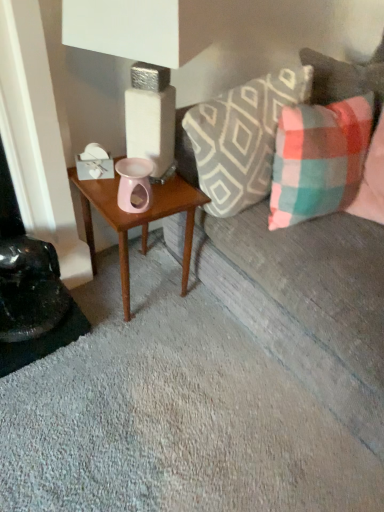
The height and width of the screenshot is (512, 384). Describe the element at coordinates (242, 138) in the screenshot. I see `plaid fabric pillow at upper right, which is the 1th pillow in left-to-right order` at that location.

At what (x,y) coordinates should I click in order to perform the action: click on plaid fabric pillow at upper right, arranged as the 2th pillow when viewed from the right. Please return your answer as a coordinate pair (x, y). This screenshot has height=512, width=384. Looking at the image, I should click on (242, 138).

Identify the location of plaid fabric couch at upper right. (308, 302).

The height and width of the screenshot is (512, 384). What are the coordinates of `plaid fabric pillow at right, which is the second pillow from left to right` in the screenshot? It's located at (319, 159).

Measure the distance between plaid fabric couch at upper right and plaid fabric pillow at right, the 1th pillow viewed from the right.

They are 24.21 centimeters apart.

From a real-world perspective, who is located higher, plaid fabric couch at upper right or plaid fabric pillow at right, which is the second pillow from left to right?

In real-world perspective, plaid fabric pillow at right, which is the second pillow from left to right, is above.

Can you confirm if plaid fabric couch at upper right is taller than plaid fabric pillow at right, which is the second pillow from left to right?

Indeed, plaid fabric couch at upper right has a greater height compared to plaid fabric pillow at right, which is the second pillow from left to right.

Which of these two, plaid fabric couch at upper right or plaid fabric pillow at right, which is the second pillow from left to right, is smaller?

plaid fabric pillow at right, which is the second pillow from left to right.

Consider the image. From the image's perspective, is plaid fabric pillow at right, the 1th pillow viewed from the right, above or below wooden table at center?

Clearly, from the image's perspective, plaid fabric pillow at right, the 1th pillow viewed from the right, is above wooden table at center.

From the picture: Considering the relative positions of plaid fabric pillow at right, the 1th pillow viewed from the right, and wooden table at center in the image provided, is plaid fabric pillow at right, the 1th pillow viewed from the right, behind wooden table at center?

No, plaid fabric pillow at right, the 1th pillow viewed from the right, is in front of wooden table at center.

Could you measure the distance between plaid fabric pillow at right, which is the second pillow from left to right, and wooden table at center?

plaid fabric pillow at right, which is the second pillow from left to right, and wooden table at center are 15.92 inches apart from each other.

Where is `table located on the left of plaid fabric pillow at right, the 1th pillow viewed from the right`? Image resolution: width=384 pixels, height=512 pixels. table located on the left of plaid fabric pillow at right, the 1th pillow viewed from the right is located at coordinates (138, 220).

Looking at this image, is wooden table at center to the left or to the right of plaid fabric couch at upper right in the image?

From the image, it's evident that wooden table at center is to the left of plaid fabric couch at upper right.

From a real-world perspective, which object stands above the other?

plaid fabric couch at upper right.

Is there a large distance between wooden table at center and plaid fabric couch at upper right?

They are positioned close to each other.

From the picture: Which is in front, wooden table at center or plaid fabric couch at upper right?

Positioned in front is plaid fabric couch at upper right.

Considering the positions of objects plaid fabric couch at upper right and plaid fabric pillow at upper right, which is the 1th pillow in left-to-right order, in the image provided, who is more to the right, plaid fabric couch at upper right or plaid fabric pillow at upper right, which is the 1th pillow in left-to-right order,?

Result: Positioned to the right is plaid fabric couch at upper right.

Where is `studio couch in front of the plaid fabric pillow at upper right, arranged as the 2th pillow when viewed from the right`? This screenshot has width=384, height=512. studio couch in front of the plaid fabric pillow at upper right, arranged as the 2th pillow when viewed from the right is located at coordinates (308, 302).

Considering the sizes of objects plaid fabric couch at upper right and plaid fabric pillow at upper right, arranged as the 2th pillow when viewed from the right, in the image provided, who is wider, plaid fabric couch at upper right or plaid fabric pillow at upper right, arranged as the 2th pillow when viewed from the right,?

plaid fabric couch at upper right.

Choose the correct answer: Is plaid fabric couch at upper right inside plaid fabric pillow at upper right, which is the 1th pillow in left-to-right order, or outside it?

The correct answer is: outside.

Considering the relative positions of plaid fabric pillow at right, the 1th pillow viewed from the right, and plaid fabric couch at upper right in the image provided, is plaid fabric pillow at right, the 1th pillow viewed from the right, to the right of plaid fabric couch at upper right from the viewer's perspective?

No.

Which point is more forward, (317, 106) or (245, 319)?

Positioned in front is point (317, 106).

Is plaid fabric pillow at right, the 1th pillow viewed from the right, with plaid fabric couch at upper right?

No, plaid fabric pillow at right, the 1th pillow viewed from the right, is not touching plaid fabric couch at upper right.

Is the depth of plaid fabric pillow at right, which is the second pillow from left to right, greater than that of plaid fabric couch at upper right?

Yes, it is behind plaid fabric couch at upper right.

From a real-world perspective, is wooden table at center physically located above or below plaid fabric pillow at right, the 1th pillow viewed from the right?

Clearly, from a real-world perspective, wooden table at center is below plaid fabric pillow at right, the 1th pillow viewed from the right.

Which object is wider, wooden table at center or plaid fabric pillow at right, which is the second pillow from left to right?

With larger width is plaid fabric pillow at right, which is the second pillow from left to right.

Is plaid fabric pillow at right, which is the second pillow from left to right, at the back of wooden table at center?

That's not correct — wooden table at center is not looking away from plaid fabric pillow at right, which is the second pillow from left to right.

Based on the photo, from the image's perspective, which object appears higher, wooden table at center or plaid fabric pillow at right, the 1th pillow viewed from the right?

plaid fabric pillow at right, the 1th pillow viewed from the right, appears higher in the image.

Is plaid fabric couch at upper right bigger or smaller than wooden table at center?

In the image, plaid fabric couch at upper right appears to be larger than wooden table at center.

Is plaid fabric couch at upper right shorter than wooden table at center?

Incorrect, the height of plaid fabric couch at upper right does not fall short of that of wooden table at center.

Considering the sizes of objects plaid fabric couch at upper right and wooden table at center in the image provided, who is thinner, plaid fabric couch at upper right or wooden table at center?

wooden table at center is thinner.

Which object is further away from the camera taking this photo, plaid fabric couch at upper right or wooden table at center?

wooden table at center is further from the camera.

Starting from the plaid fabric couch at upper right, which pillow is the 1st one behind? Please provide its 2D coordinates.

[(319, 159)]

The image size is (384, 512). I want to click on the 2nd pillow to the right of the wooden table at center, counting from the anchor's position, so click(319, 159).

Which object lies further to the anchor point plaid fabric couch at upper right, plaid fabric pillow at upper right, arranged as the 2th pillow when viewed from the right, or plaid fabric pillow at right, the 1th pillow viewed from the right?

plaid fabric pillow at upper right, arranged as the 2th pillow when viewed from the right, is further to plaid fabric couch at upper right.

Which object lies further to the anchor point plaid fabric pillow at upper right, which is the 1th pillow in left-to-right order, plaid fabric pillow at right, the 1th pillow viewed from the right, or wooden table at center?

wooden table at center is positioned further to the anchor plaid fabric pillow at upper right, which is the 1th pillow in left-to-right order.

Looking at the image, which one is located further to plaid fabric pillow at right, the 1th pillow viewed from the right, wooden table at center or plaid fabric pillow at upper right, arranged as the 2th pillow when viewed from the right?

wooden table at center is further to plaid fabric pillow at right, the 1th pillow viewed from the right.

Estimate the real-world distances between objects in this image. Which object is closer to wooden table at center, plaid fabric pillow at upper right, arranged as the 2th pillow when viewed from the right, or plaid fabric couch at upper right?

Based on the image, plaid fabric pillow at upper right, arranged as the 2th pillow when viewed from the right, appears to be nearer to wooden table at center.

Looking at the image, which one is located closer to wooden table at center, plaid fabric pillow at right, the 1th pillow viewed from the right, or plaid fabric pillow at upper right, which is the 1th pillow in left-to-right order?

Based on the image, plaid fabric pillow at upper right, which is the 1th pillow in left-to-right order, appears to be nearer to wooden table at center.

Which object lies further to the anchor point plaid fabric pillow at right, the 1th pillow viewed from the right, plaid fabric pillow at upper right, arranged as the 2th pillow when viewed from the right, or wooden table at center?

The object further to plaid fabric pillow at right, the 1th pillow viewed from the right, is wooden table at center.

From the picture: Looking at the image, which one is located closer to plaid fabric pillow at upper right, arranged as the 2th pillow when viewed from the right, plaid fabric couch at upper right or wooden table at center?

The object closer to plaid fabric pillow at upper right, arranged as the 2th pillow when viewed from the right, is wooden table at center.

When comparing their distances from plaid fabric pillow at upper right, arranged as the 2th pillow when viewed from the right, does plaid fabric pillow at right, the 1th pillow viewed from the right, or plaid fabric couch at upper right seem closer?

Among the two, plaid fabric pillow at right, the 1th pillow viewed from the right, is located nearer to plaid fabric pillow at upper right, arranged as the 2th pillow when viewed from the right.

The image size is (384, 512). I want to click on pillow situated between wooden table at center and plaid fabric pillow at right, the 1th pillow viewed from the right, from left to right, so click(x=242, y=138).

At what (x,y) coordinates should I click in order to perform the action: click on pillow positioned between plaid fabric couch at upper right and plaid fabric pillow at upper right, arranged as the 2th pillow when viewed from the right, from near to far. Please return your answer as a coordinate pair (x, y). Looking at the image, I should click on (319, 159).